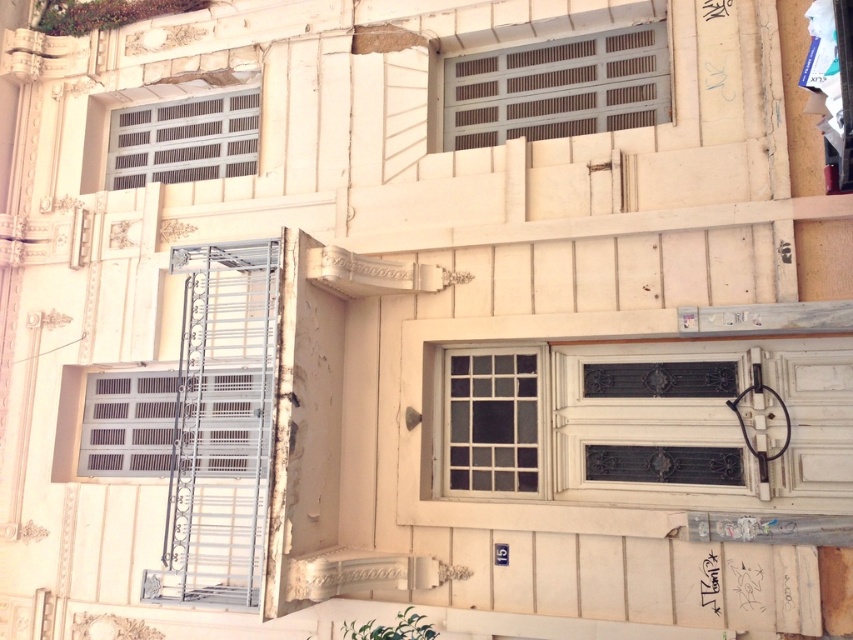
Between white glass window at center and metallic gray shutter at upper center, which one appears on the right side from the viewer's perspective?

white glass window at center is more to the right.

Is point (471, 449) more distant than point (218, 109)?

That is False.

Identify the location of white glass window at center. (492, 420).

Which is in front, point (115, 429) or point (462, 476)?

Point (462, 476)

Can you confirm if white painted metal at center is positioned above white glass window at center?

Incorrect, white painted metal at center is not positioned above white glass window at center.

Which is in front, point (140, 474) or point (506, 353)?

Positioned in front is point (506, 353).

Identify the location of white painted metal at center. This screenshot has height=640, width=853. (128, 422).

Does metallic gray window at upper center have a smaller size compared to metallic gray shutter at upper center?

No, metallic gray window at upper center is not smaller than metallic gray shutter at upper center.

Does point (585, 97) come closer to viewer compared to point (152, 132)?

Yes, it is in front of point (152, 132).

What do you see at coordinates (558, 88) in the screenshot? This screenshot has height=640, width=853. I see `metallic gray window at upper center` at bounding box center [558, 88].

Identify the location of metallic gray window at upper center. The height and width of the screenshot is (640, 853). (558, 88).